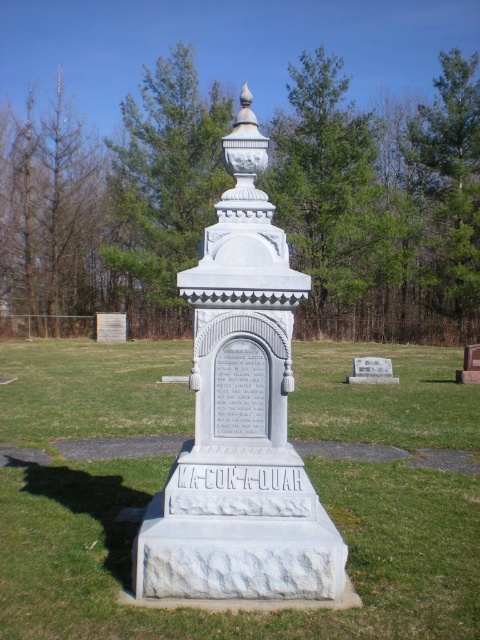
Question: Does green grass at center appear on the right side of white stone monument at center?

Choices:
 (A) yes
 (B) no

Answer: (A)

Question: Can you confirm if green grass at center is positioned to the right of white stone monument at center?

Choices:
 (A) yes
 (B) no

Answer: (A)

Question: Which object is farther from the camera taking this photo?

Choices:
 (A) white stone monument at center
 (B) green grass at center

Answer: (A)

Question: Is green grass at center positioned at the back of white stone monument at center?

Choices:
 (A) no
 (B) yes

Answer: (A)

Question: Which point is farther to the camera?

Choices:
 (A) green grass at center
 (B) white stone monument at center

Answer: (B)